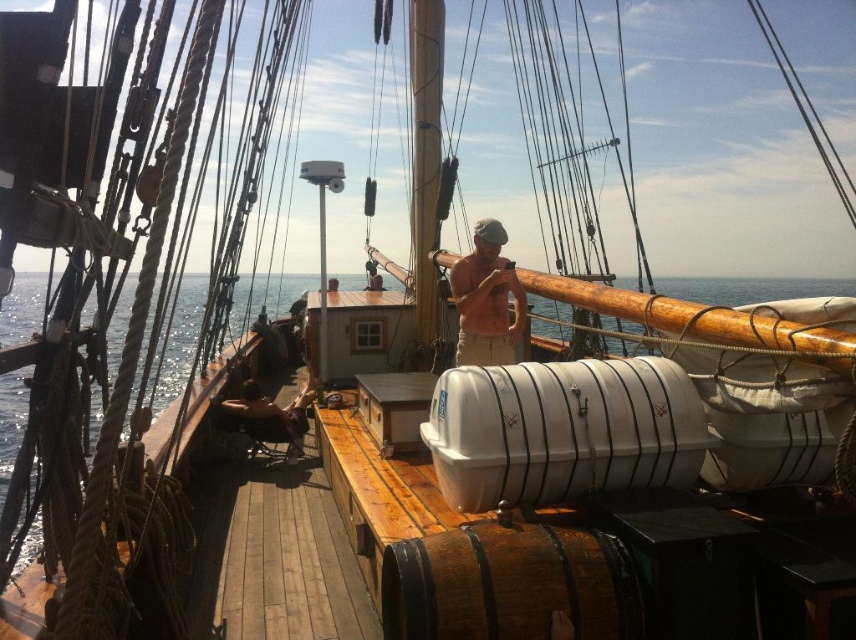
How much distance is there between tan cotton shirt at center and smooth brown hair at lower left?

They are 2.55 meters apart.

Can you confirm if tan cotton shirt at center is positioned below smooth brown hair at lower left?

No, tan cotton shirt at center is not below smooth brown hair at lower left.

Is point (506, 298) positioned behind point (269, 435)?

No, it is not.

Where is `tan cotton shirt at center`? This screenshot has height=640, width=856. tan cotton shirt at center is located at coordinates (486, 300).